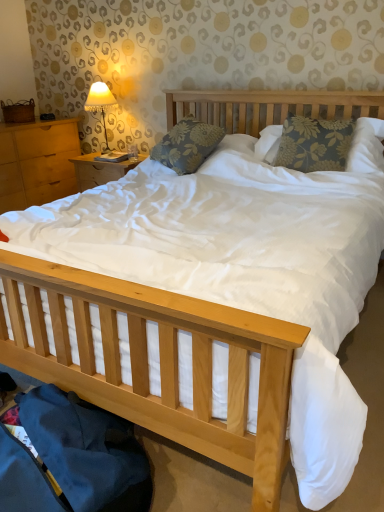
Question: From a real-world perspective, is floral fabric pillow at center, placed as the second pillow when sorted from left to right, positioned under matte fabric lampshade at upper left based on gravity?

Choices:
 (A) yes
 (B) no

Answer: (A)

Question: Is floral fabric pillow at center, which is the first pillow from right to left, taller than matte fabric lampshade at upper left?

Choices:
 (A) no
 (B) yes

Answer: (A)

Question: Is the depth of floral fabric pillow at center, placed as the second pillow when sorted from left to right, greater than that of matte fabric lampshade at upper left?

Choices:
 (A) no
 (B) yes

Answer: (A)

Question: Can you confirm if floral fabric pillow at center, which is the first pillow from right to left, is wider than matte fabric lampshade at upper left?

Choices:
 (A) yes
 (B) no

Answer: (A)

Question: Is floral fabric pillow at center, placed as the second pillow when sorted from left to right, not close to matte fabric lampshade at upper left?

Choices:
 (A) yes
 (B) no

Answer: (A)

Question: Is point (182, 132) closer or farther from the camera than point (112, 106)?

Choices:
 (A) closer
 (B) farther

Answer: (A)

Question: From a real-world perspective, is floral fabric pillow at center, which ranks as the 1th pillow in left-to-right order, physically located above or below matte fabric lampshade at upper left?

Choices:
 (A) above
 (B) below

Answer: (B)

Question: Considering the relative positions of floral fabric pillow at center, the second pillow from the right, and matte fabric lampshade at upper left in the image provided, is floral fabric pillow at center, the second pillow from the right, to the left or to the right of matte fabric lampshade at upper left?

Choices:
 (A) left
 (B) right

Answer: (B)

Question: In the image, is floral fabric pillow at center, the second pillow from the right, positioned in front of or behind matte fabric lampshade at upper left?

Choices:
 (A) behind
 (B) front

Answer: (B)

Question: From a real-world perspective, is floral fabric pillow at center, which is the first pillow from right to left, above or below light brown wood at left?

Choices:
 (A) below
 (B) above

Answer: (B)

Question: Is floral fabric pillow at center, placed as the second pillow when sorted from left to right, inside the boundaries of light brown wood at left, or outside?

Choices:
 (A) outside
 (B) inside

Answer: (A)

Question: In terms of width, does floral fabric pillow at center, placed as the second pillow when sorted from left to right, look wider or thinner when compared to light brown wood at left?

Choices:
 (A) thin
 (B) wide

Answer: (A)

Question: In the image, is floral fabric pillow at center, placed as the second pillow when sorted from left to right, on the left side or the right side of light brown wood at left?

Choices:
 (A) right
 (B) left

Answer: (A)

Question: From the image's perspective, relative to floral fabric pillow at center, the second pillow from the right, is floral fabric pillow at center, which is the first pillow from right to left, above or below?

Choices:
 (A) above
 (B) below

Answer: (B)

Question: Considering the relative positions of floral fabric pillow at center, placed as the second pillow when sorted from left to right, and floral fabric pillow at center, which ranks as the 1th pillow in left-to-right order, in the image provided, is floral fabric pillow at center, placed as the second pillow when sorted from left to right, to the left or to the right of floral fabric pillow at center, which ranks as the 1th pillow in left-to-right order,?

Choices:
 (A) right
 (B) left

Answer: (A)